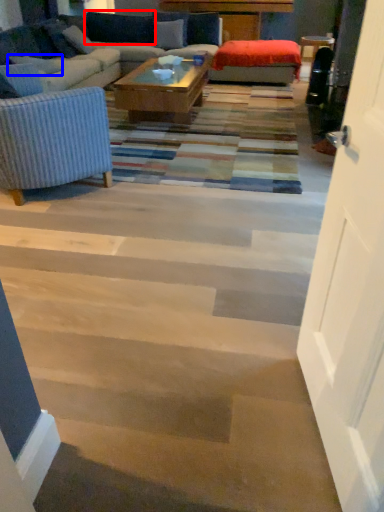
Question: Which object appears farthest to the camera in this image, pillow (highlighted by a red box) or pillow (highlighted by a blue box)?

Choices:
 (A) pillow
 (B) pillow

Answer: (A)